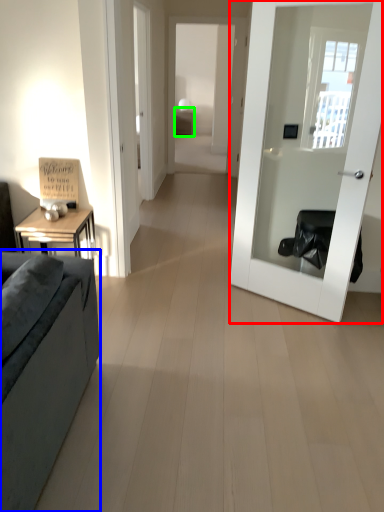
Question: Estimate the real-world distances between objects in this image. Which object is farther from door (highlighted by a red box), studio couch (highlighted by a blue box) or table (highlighted by a green box)?

Choices:
 (A) studio couch
 (B) table

Answer: (B)